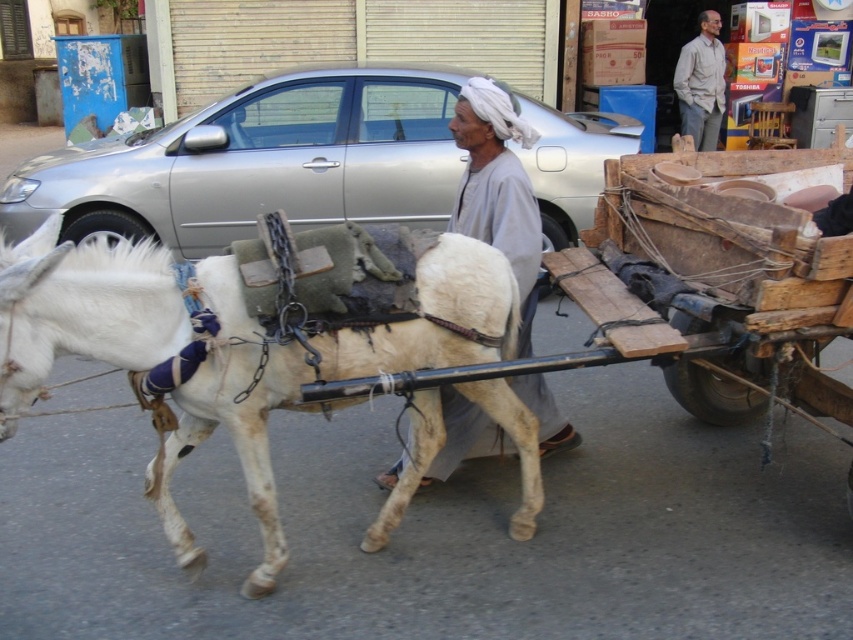
You are standing at the camera position and want to take a photo of the silver metallic car at center. If your camera has a maximum focus range of 6 meters, will you be able to capture the car clearly?

The silver metallic car at center and camera are 6.45 meters apart from each other. Since the distance exceeds the camera maximum focus range of 6 meters, the car will not be captured clearly.

You are a delivery person trying to navigate a narrow alley. You see a white leather horse at center and a silver metallic car at center. Which one takes up more space horizontally?

The silver metallic car at center is wider than the white leather horse at center, so the silver metallic car at center takes up more horizontal space.